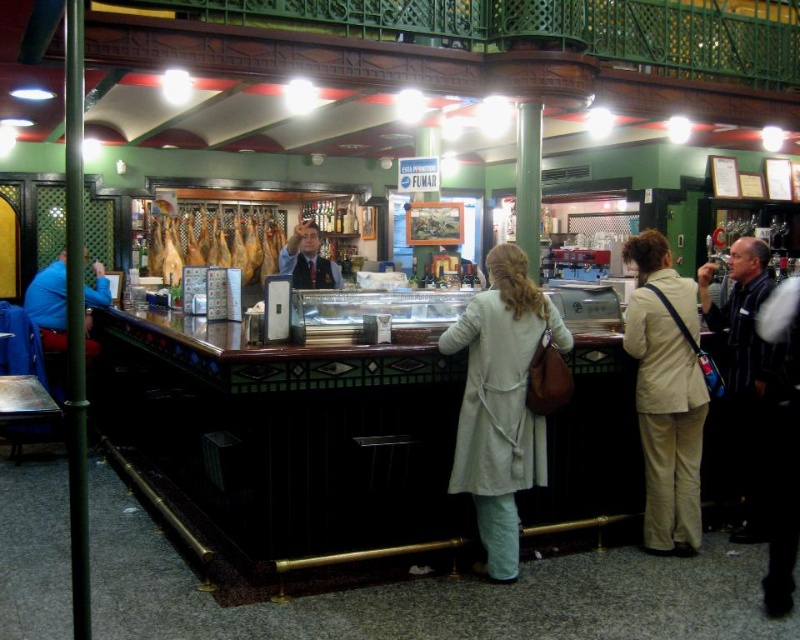
Question: Which is farther from the light beige coat at center?

Choices:
 (A) beige fabric coat at center
 (B) smoked ham at center

Answer: (B)

Question: Is light beige coat at center closer to camera compared to smoked ham at center?

Choices:
 (A) yes
 (B) no

Answer: (A)

Question: Which point is closer to the camera?

Choices:
 (A) (678, 362)
 (B) (502, 349)

Answer: (B)

Question: From the image, what is the correct spatial relationship of light beige coat at center in relation to beige fabric coat at center?

Choices:
 (A) right
 (B) left

Answer: (B)

Question: Which object appears farthest from the camera in this image?

Choices:
 (A) smoked ham at center
 (B) beige fabric coat at center

Answer: (A)

Question: Is light beige coat at center to the left of beige fabric coat at center from the viewer's perspective?

Choices:
 (A) no
 (B) yes

Answer: (B)